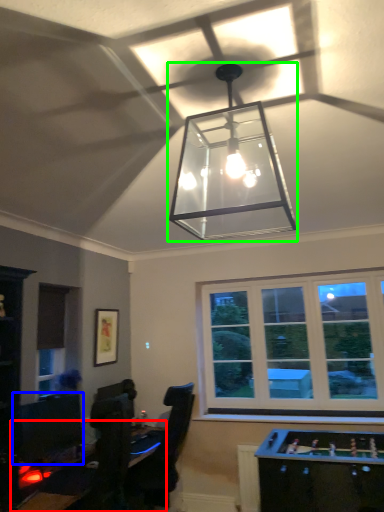
Question: Which object is the closest to the table (highlighted by a red box)? Choose among these: computer monitor (highlighted by a blue box) or lamp (highlighted by a green box).

Choices:
 (A) computer monitor
 (B) lamp

Answer: (A)